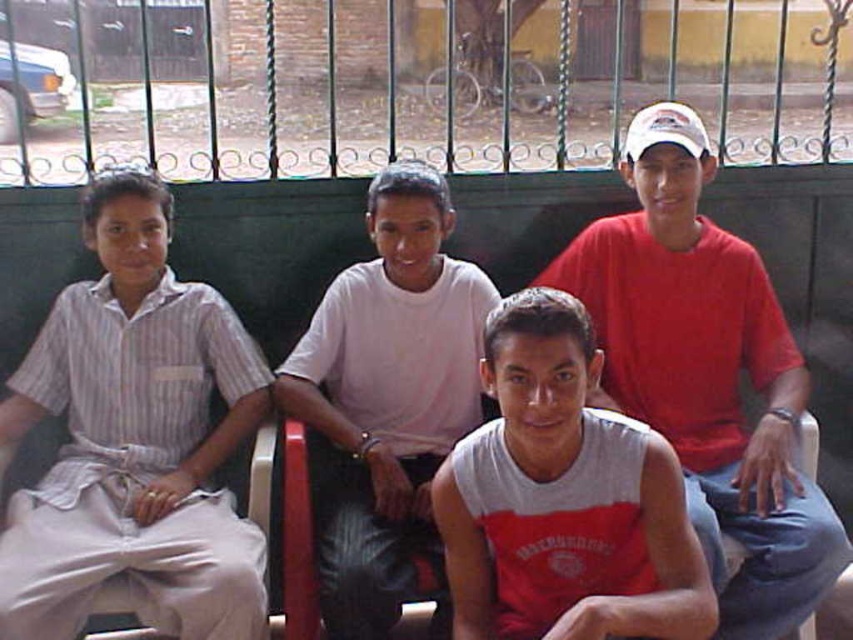
Question: Is matte red t-shirt at center closer to the viewer compared to gray matte tank top at center?

Choices:
 (A) no
 (B) yes

Answer: (A)

Question: Is white striped shirt at left positioned before gray matte tank top at center?

Choices:
 (A) yes
 (B) no

Answer: (B)

Question: Which of the following is the closest to the observer?

Choices:
 (A) (311, 349)
 (B) (274, 627)
 (C) (64, 307)

Answer: (C)

Question: Which object is closer to the camera taking this photo?

Choices:
 (A) gray matte tank top at center
 (B) red fabric chair at lower center
 (C) white striped shirt at left
 (D) white cotton shirt at center

Answer: (A)

Question: Is matte red t-shirt at center smaller than white cotton shirt at center?

Choices:
 (A) yes
 (B) no

Answer: (B)

Question: Which point is closer to the camera taking this photo?

Choices:
 (A) click(479, 317)
 (B) click(608, 509)
 (C) click(291, 529)
 (D) click(711, 276)

Answer: (B)